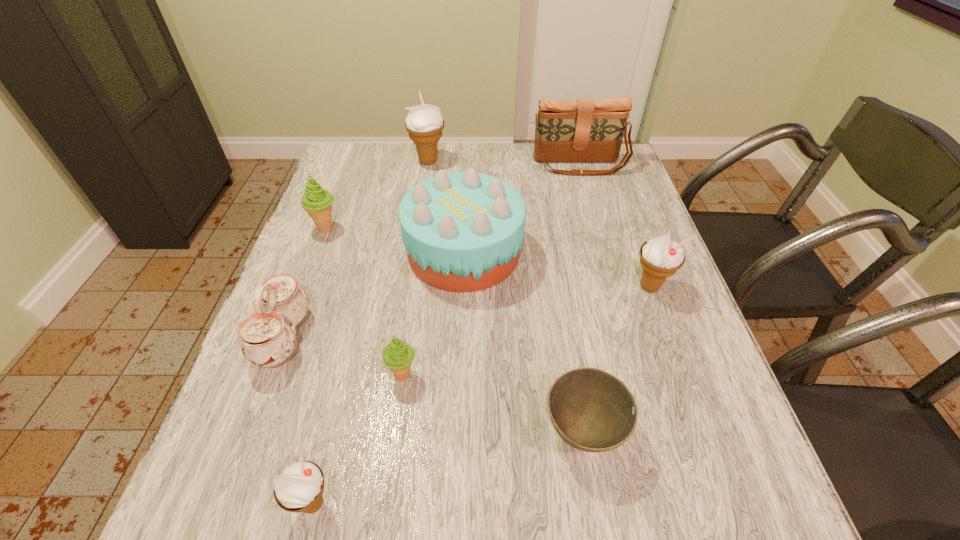
This screenshot has width=960, height=540. Identify the location of object positioned at the near left corner. (301, 483).

The width and height of the screenshot is (960, 540). What are the coordinates of `object that is at the far right corner` in the screenshot? It's located at (583, 130).

Find the location of `vacant area at the far edge`. vacant area at the far edge is located at coordinates (428, 167).

This screenshot has width=960, height=540. I want to click on free space at the near edge, so click(476, 521).

Locate an element on the screen. This screenshot has width=960, height=540. vacant space at the left edge of the desktop is located at coordinates (311, 228).

Locate an element on the screen. This screenshot has width=960, height=540. vacant region at the right edge of the desktop is located at coordinates (604, 206).

Locate an element on the screen. This screenshot has width=960, height=540. free spot at the far left corner of the desktop is located at coordinates (345, 172).

In the image, there is a desktop. At what (x,y) coordinates should I click in order to perform the action: click on vacant space at the near left corner. Please return your answer as a coordinate pair (x, y). The height and width of the screenshot is (540, 960). Looking at the image, I should click on (291, 513).

This screenshot has width=960, height=540. I want to click on vacant space at the far right corner, so click(621, 152).

Where is `free space between the shoulder bag and the smallest white icecream`? free space between the shoulder bag and the smallest white icecream is located at coordinates coord(446,334).